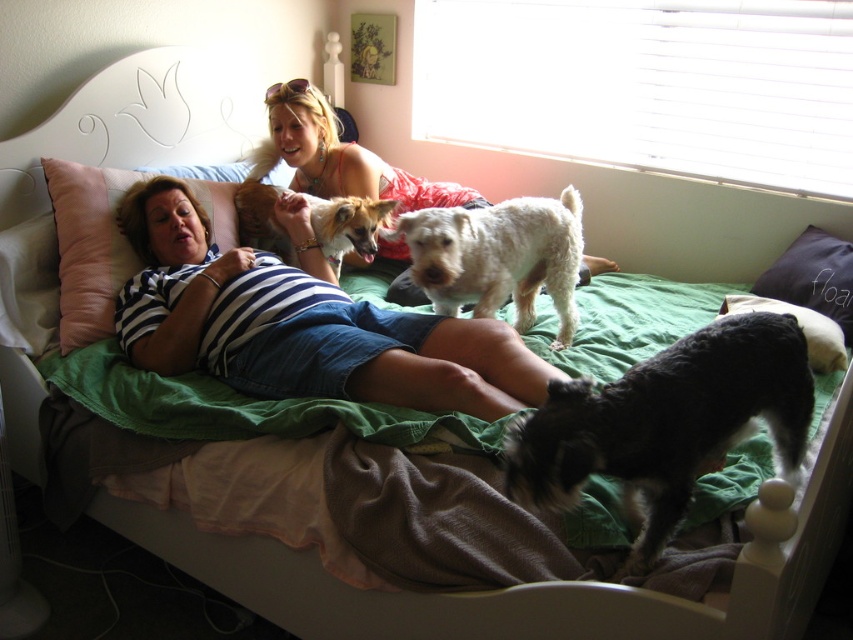
Question: Where is striped fabric shirt at upper left located in relation to black fuzzy dog at lower right in the image?

Choices:
 (A) right
 (B) left

Answer: (B)

Question: Can you confirm if black fuzzy dog at lower right is positioned to the left of green fabric pillow at upper center?

Choices:
 (A) yes
 (B) no

Answer: (A)

Question: Which of the following is the closest to the observer?

Choices:
 (A) (598, 403)
 (B) (115, 305)
 (C) (80, 266)
 (D) (300, 164)

Answer: (A)

Question: Which of these objects is positioned farthest from the purple fabric pillow at right?

Choices:
 (A) striped fabric shirt at upper left
 (B) brown fur dog at center
 (C) white fluffy dog at center
 (D) black fuzzy dog at lower right

Answer: (B)

Question: Is black fuzzy dog at lower right wider than matte pink dress at center?

Choices:
 (A) yes
 (B) no

Answer: (B)

Question: Which of these objects is positioned closest to the pink fabric pillow at left?

Choices:
 (A) black fuzzy dog at lower right
 (B) green fabric pillow at upper center

Answer: (A)